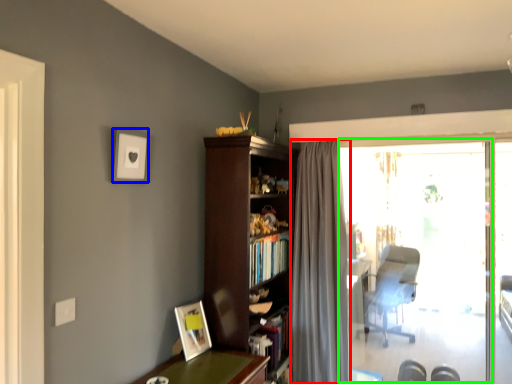
Question: Estimate the real-world distances between objects in this image. Which object is closer to curtain (highlighted by a red box), picture frame (highlighted by a blue box) or window screen (highlighted by a green box)?

Choices:
 (A) picture frame
 (B) window screen

Answer: (A)